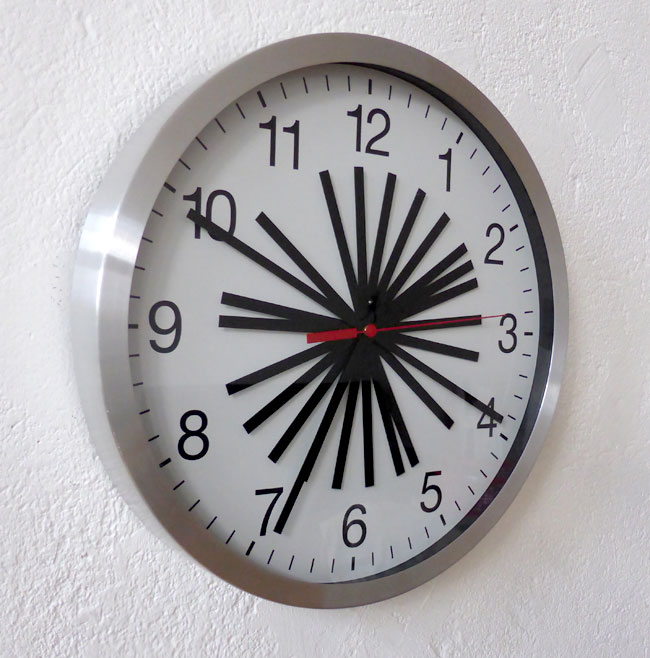
Find the location of a particular element. textured wall is located at coordinates (53, 508), (582, 578).